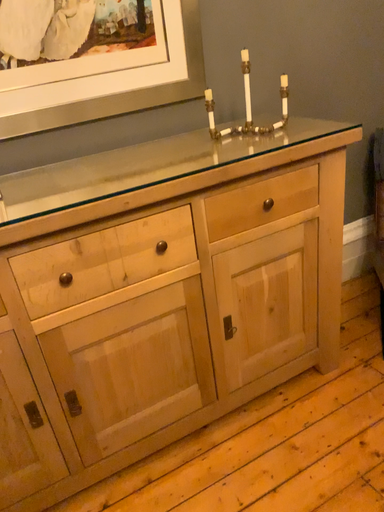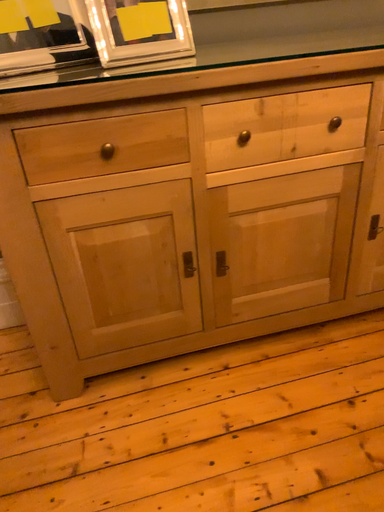
Question: Which way did the camera rotate in the video?

Choices:
 (A) rotated right
 (B) rotated left

Answer: (B)